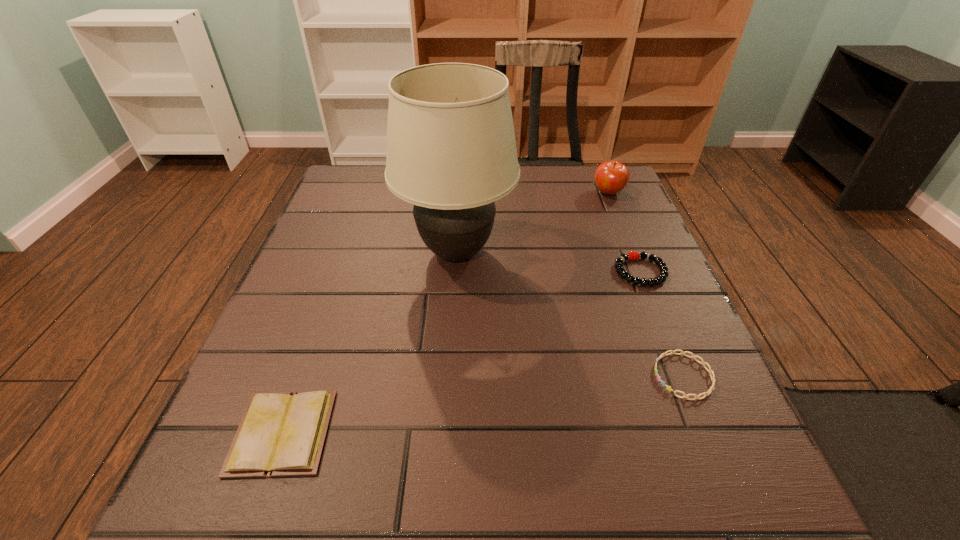
I want to click on free space between the lampshade and the diary, so click(x=370, y=343).

The height and width of the screenshot is (540, 960). I want to click on vacant space that is in between the diary and the fourth shortest object, so click(x=445, y=313).

Locate an element on the screen. This screenshot has height=540, width=960. blank region between the farther bracelet and the diary is located at coordinates (462, 352).

You are a GUI agent. You are given a task and a screenshot of the screen. Output one action in this format:
    pyautogui.click(x=<x>, y=<y>)
    Task: Click on the free point between the fourth object from right to left and the leftmost object
    The image size is (960, 540).
    Given the screenshot: What is the action you would take?
    pyautogui.click(x=370, y=343)

The width and height of the screenshot is (960, 540). I want to click on vacant space in between the farther bracelet and the second object from left to right, so click(x=548, y=262).

Identify which object is located as the third nearest to the lampshade. Please provide its 2D coordinates. Your answer should be formatted as a tuple, i.e. [(x, y)], where the tuple contains the x and y coordinates of a point satisfying the conditions above.

[(280, 434)]

Find the location of `object that is the fourth closest one to the taller bracelet`. object that is the fourth closest one to the taller bracelet is located at coordinates (280, 434).

Find the location of a particular element. The width and height of the screenshot is (960, 540). vacant space that satisfies the following two spatial constraints: 1. on the back side of the apple; 2. on the left side of the fourth object from right to left is located at coordinates (460, 193).

Identify the location of free spot that satisfies the following two spatial constraints: 1. on the back side of the fourth shortest object; 2. on the left side of the lampshade. (460, 193).